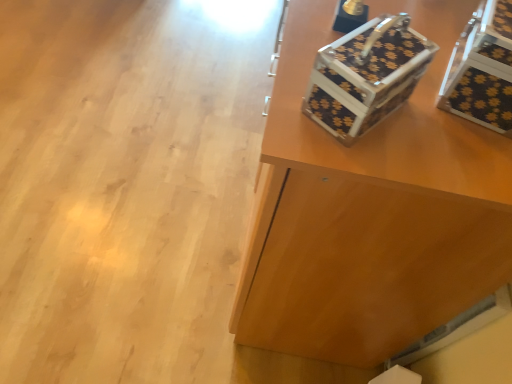
At what (x,y) coordinates should I click in order to perform the action: click on vacant space to the right of metallic floral-patterned shoe box at upper right. Please return your answer as a coordinate pair (x, y). This screenshot has height=384, width=512. Looking at the image, I should click on (441, 147).